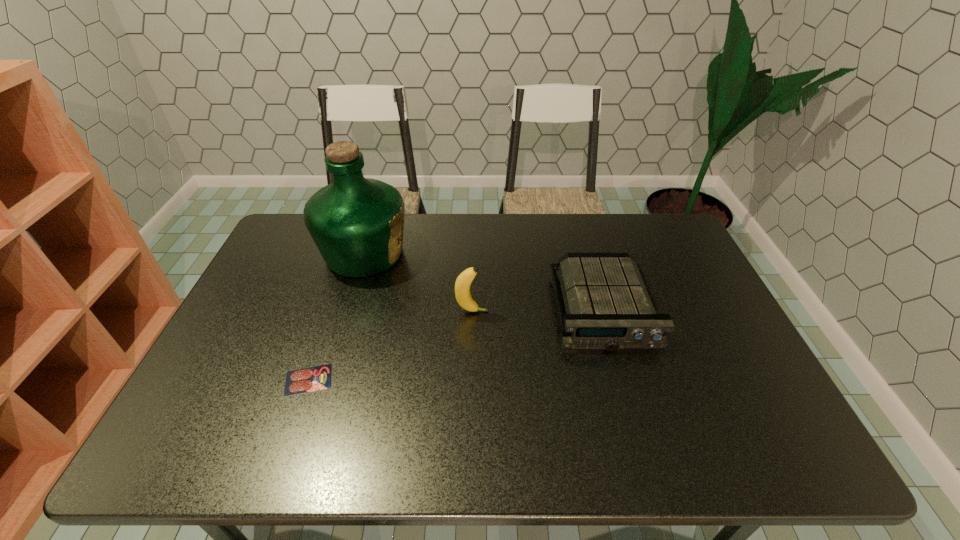
Locate an element on the screen. This screenshot has height=540, width=960. free location located on the right of the nearest object is located at coordinates (493, 380).

Image resolution: width=960 pixels, height=540 pixels. I want to click on object that is at the far edge, so click(x=357, y=223).

Where is `object located in the left edge section of the desktop`? Image resolution: width=960 pixels, height=540 pixels. object located in the left edge section of the desktop is located at coordinates (357, 223).

The image size is (960, 540). I want to click on object that is at the far left corner, so click(x=357, y=223).

Image resolution: width=960 pixels, height=540 pixels. Identify the location of free spot at the far edge of the desktop. (599, 238).

Locate an element on the screen. free space at the near edge of the desktop is located at coordinates (645, 436).

Locate an element on the screen. free region at the left edge of the desktop is located at coordinates 307,264.

This screenshot has width=960, height=540. In order to click on vacant space at the right edge of the desktop in this screenshot , I will do (x=688, y=323).

Find the location of a particular element. free location at the near left corner is located at coordinates (227, 431).

I want to click on blank space at the far right corner of the desktop, so click(x=674, y=237).